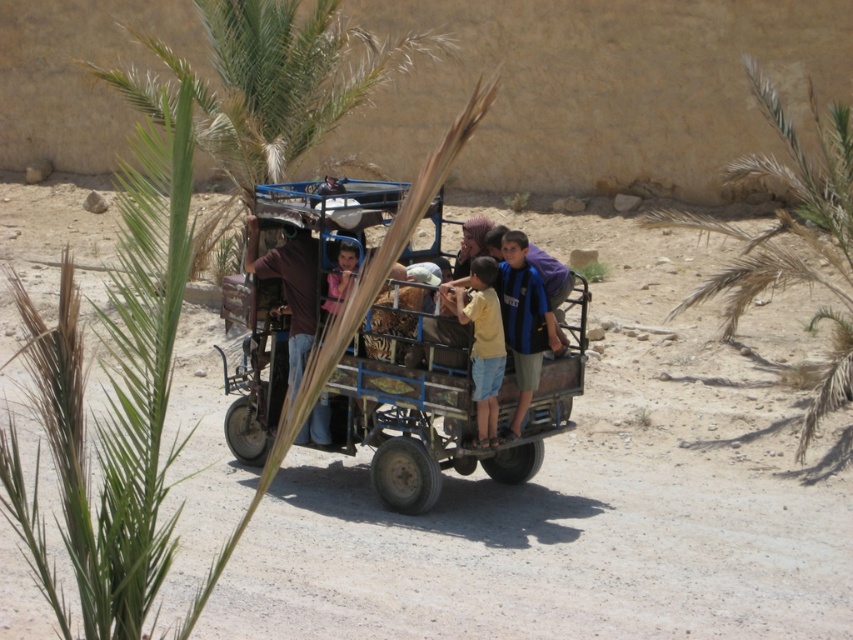
Question: Does green leafy palm at upper right have a lesser width compared to brown leather jacket at center?

Choices:
 (A) yes
 (B) no

Answer: (A)

Question: Which point is closer to the camera taking this photo?

Choices:
 (A) (503, 256)
 (B) (782, 225)
 (C) (457, 403)
 (D) (338, 257)

Answer: (C)

Question: Which of the following is the farthest from the observer?

Choices:
 (A) (328, 289)
 (B) (338, 444)
 (C) (306, 289)
 (D) (491, 291)

Answer: (B)

Question: Which point is closer to the camera?

Choices:
 (A) (821, 157)
 (B) (347, 269)
 (C) (520, 310)

Answer: (C)

Question: Can you confirm if blue metallic wagon at center is positioned to the left of yellow matte shirt at center?

Choices:
 (A) no
 (B) yes

Answer: (B)

Question: Can you confirm if blue metallic wagon at center is thinner than yellow matte shirt at center?

Choices:
 (A) no
 (B) yes

Answer: (A)